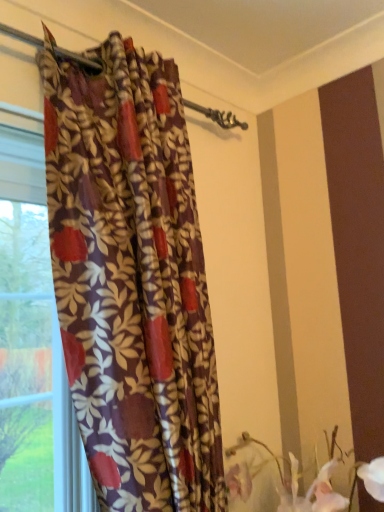
The image size is (384, 512). I want to click on fluffy fabric flowers at lower right, so click(x=293, y=481).

Measure the distance between point (293, 464) and camera.

The distance of point (293, 464) from camera is 1.18 meters.

Describe the element at coordinates (293, 481) in the screenshot. This screenshot has height=512, width=384. I see `fluffy fabric flowers at lower right` at that location.

Identify the location of floral-patterned fabric curtain at left. This screenshot has height=512, width=384. (132, 280).

Image resolution: width=384 pixels, height=512 pixels. What do you see at coordinates (132, 280) in the screenshot?
I see `floral-patterned fabric curtain at left` at bounding box center [132, 280].

This screenshot has width=384, height=512. Identify the location of fluffy fabric flowers at lower right. (293, 481).

Considering the relative positions of fluffy fabric flowers at lower right and floral-patterned fabric curtain at left in the image provided, is fluffy fabric flowers at lower right to the left of floral-patterned fabric curtain at left from the viewer's perspective?

Incorrect, fluffy fabric flowers at lower right is not on the left side of floral-patterned fabric curtain at left.

Which object is more forward, fluffy fabric flowers at lower right or floral-patterned fabric curtain at left?

floral-patterned fabric curtain at left is closer to the camera.

Is point (247, 492) farther from camera compared to point (69, 63)?

Yes, it is behind point (69, 63).

From the image's perspective, which one is positioned higher, fluffy fabric flowers at lower right or floral-patterned fabric curtain at left?

floral-patterned fabric curtain at left.

From a real-world perspective, is fluffy fabric flowers at lower right located higher than floral-patterned fabric curtain at left?

Incorrect, from a real-world perspective, fluffy fabric flowers at lower right is lower than floral-patterned fabric curtain at left.

Does fluffy fabric flowers at lower right have a greater width compared to floral-patterned fabric curtain at left?

Correct, the width of fluffy fabric flowers at lower right exceeds that of floral-patterned fabric curtain at left.

Does fluffy fabric flowers at lower right have a lesser height compared to floral-patterned fabric curtain at left?

Yes, fluffy fabric flowers at lower right is shorter than floral-patterned fabric curtain at left.

Between fluffy fabric flowers at lower right and floral-patterned fabric curtain at left, which one has smaller size?

fluffy fabric flowers at lower right.

Could floral-patterned fabric curtain at left be considered to be inside fluffy fabric flowers at lower right?

No, floral-patterned fabric curtain at left is not surrounded by fluffy fabric flowers at lower right.

Are fluffy fabric flowers at lower right and floral-patterned fabric curtain at left making contact?

No, fluffy fabric flowers at lower right is not with floral-patterned fabric curtain at left.

Is floral-patterned fabric curtain at left at the back of fluffy fabric flowers at lower right?

No, floral-patterned fabric curtain at left is not at the back of fluffy fabric flowers at lower right.

Can you tell me how much fluffy fabric flowers at lower right and floral-patterned fabric curtain at left differ in facing direction?

The facing directions of fluffy fabric flowers at lower right and floral-patterned fabric curtain at left are 2.72 degrees apart.

At what (x,y) coordinates should I click in order to perform the action: click on curtain on the left of fluffy fabric flowers at lower right. Please return your answer as a coordinate pair (x, y). Looking at the image, I should click on (132, 280).

Considering the relative positions of floral-patterned fabric curtain at left and fluffy fabric flowers at lower right in the image provided, is floral-patterned fabric curtain at left to the left of fluffy fabric flowers at lower right from the viewer's perspective?

Indeed, floral-patterned fabric curtain at left is positioned on the left side of fluffy fabric flowers at lower right.

Is floral-patterned fabric curtain at left further to camera compared to fluffy fabric flowers at lower right?

No, it is in front of fluffy fabric flowers at lower right.

Is point (142, 349) positioned after point (234, 452)?

No, it is not.

From the image's perspective, is floral-patterned fabric curtain at left over fluffy fabric flowers at lower right?

Correct, floral-patterned fabric curtain at left appears higher than fluffy fabric flowers at lower right in the image.

From a real-world perspective, is floral-patterned fabric curtain at left below fluffy fabric flowers at lower right?

No, from a real-world perspective, floral-patterned fabric curtain at left is not beneath fluffy fabric flowers at lower right.

Is floral-patterned fabric curtain at left wider than fluffy fabric flowers at lower right?

Incorrect, the width of floral-patterned fabric curtain at left does not surpass that of fluffy fabric flowers at lower right.

Considering the relative sizes of floral-patterned fabric curtain at left and fluffy fabric flowers at lower right in the image provided, is floral-patterned fabric curtain at left shorter than fluffy fabric flowers at lower right?

No.

Does floral-patterned fabric curtain at left have a larger size compared to fluffy fabric flowers at lower right?

Correct, floral-patterned fabric curtain at left is larger in size than fluffy fabric flowers at lower right.

From the picture: Would you say floral-patterned fabric curtain at left contains fluffy fabric flowers at lower right?

Definitely not — fluffy fabric flowers at lower right is not inside floral-patterned fabric curtain at left.

Is floral-patterned fabric curtain at left far away from fluffy fabric flowers at lower right?

Actually, floral-patterned fabric curtain at left and fluffy fabric flowers at lower right are a little close together.

Is floral-patterned fabric curtain at left facing towards fluffy fabric flowers at lower right?

No, floral-patterned fabric curtain at left is not turned towards fluffy fabric flowers at lower right.

How different are the orientations of floral-patterned fabric curtain at left and fluffy fabric flowers at lower right in degrees?

The angle between the facing direction of floral-patterned fabric curtain at left and the facing direction of fluffy fabric flowers at lower right is 2.72 degrees.

Measure the distance between floral-patterned fabric curtain at left and fluffy fabric flowers at lower right.

They are 17.72 inches apart.

This screenshot has height=512, width=384. What are the coordinates of `floral arrangement below the floral-patterned fabric curtain at left (from a real-world perspective)` in the screenshot? It's located at (293, 481).

Identify the location of floral arrangement that appears below the floral-patterned fabric curtain at left (from the image's perspective). (293, 481).

Identify the location of curtain on the left of fluffy fabric flowers at lower right. (132, 280).